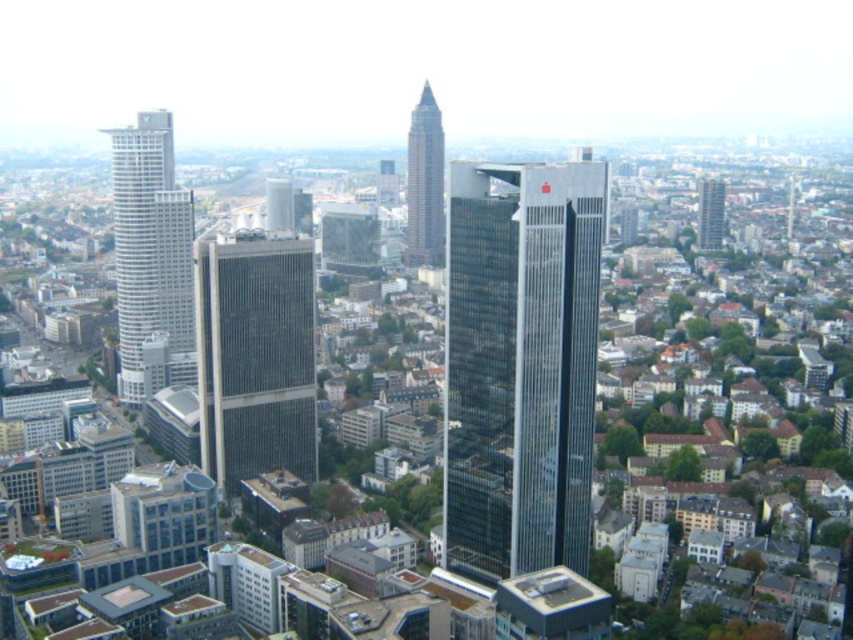
You are standing at the point marked as point (575, 220) in the city. A drone needs to deliver a package to a location that is exactly 200 meters away from you. Can the drone reach this destination without exceeding the city limits, considering the city extends up to 250 meters from your current position?

The point marked as point (575, 220) is 169.14 meters away from the viewer. Since the city extends up to 250 meters from your current position, the drone can safely reach the destination as 200 meters is within the city limits and does not exceed the maximum distance of 250 meters.

You are a city planner reviewing this urban layout. You need to determine the spatial relationship between the white glass skyscraper at left and the smooth glass skyscraper at center. Which one is positioned lower in the aerial view?

The white glass skyscraper at left is located below the smooth glass skyscraper at center, so it is positioned lower in the aerial view.

You are a drone operator flying over the city. You need to determine which of the two points, point [144,154] or point [704,244], is closer to you. According to the image, which point is nearer?

Point [144,154] is closer to the viewer than point [704,244].